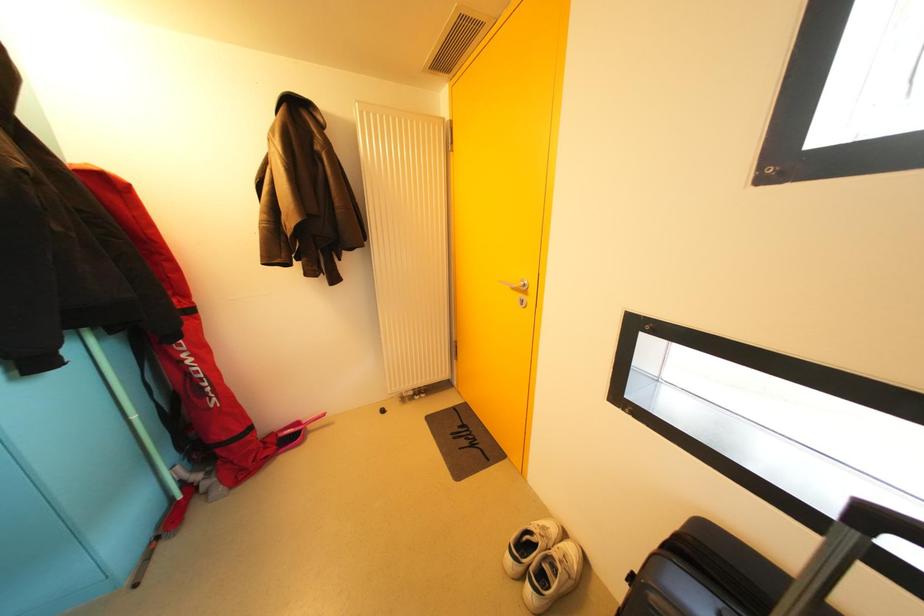
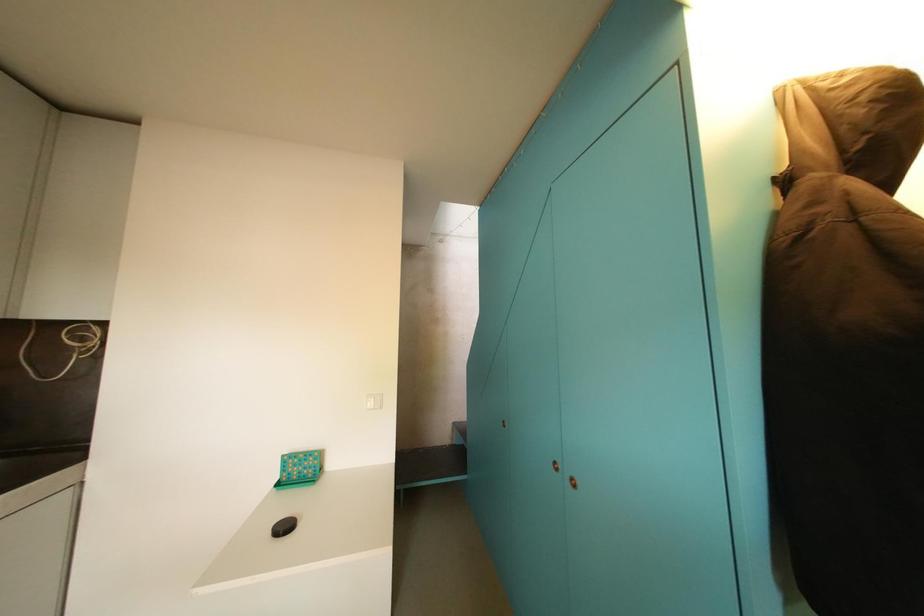
Question: The camera is either moving clockwise (left) or counter-clockwise (right) around the object. The first image is from the beginning of the video and the second image is from the end. Is the camera moving left or right when shooting the video?

Choices:
 (A) Left
 (B) Right

Answer: (B)